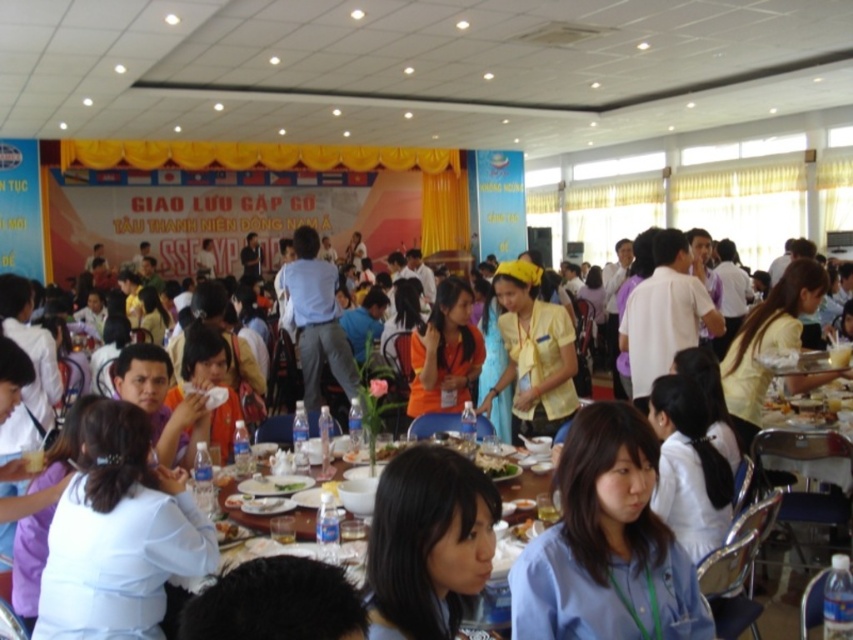
You are standing at the entrance of the hall. Where is the white glossy table at center located in the coordinate system of the image?

The white glossy table at center is located at point (281, 516) in the coordinate system of the image.

You are organizing a small presentation and need to place a laptop on the white glossy table at center. However, there is a green leafy vegetable at center already placed there. Based on their positions, can you determine which object is closer to the right side of the table?

The white glossy table at center is to the right of the green leafy vegetable at center, so the white glossy table at center is closer to the right side of the table.